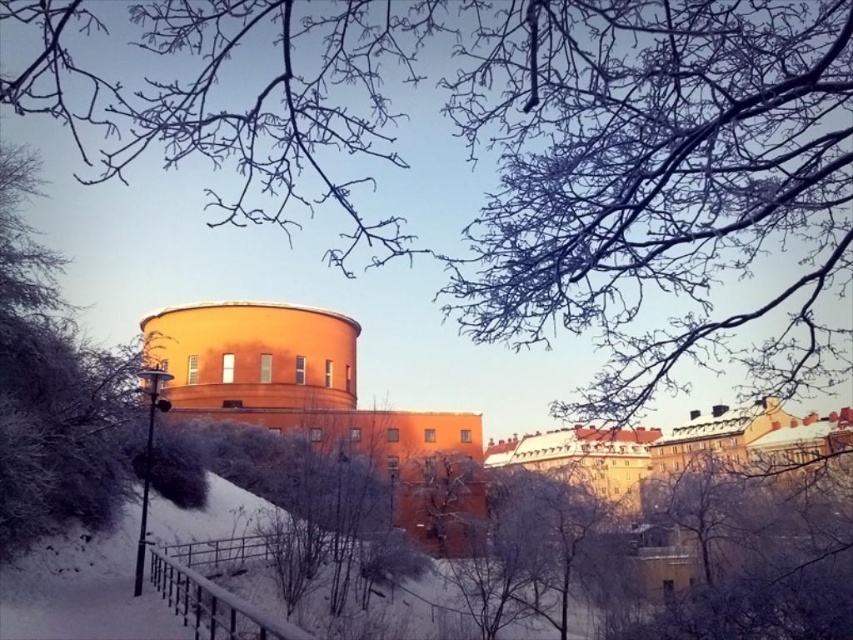
Question: Is frosty branches at upper center bigger than snow-covered branches at left?

Choices:
 (A) yes
 (B) no

Answer: (A)

Question: Which point is farther to the camera?

Choices:
 (A) frosty branches at upper center
 (B) snow-covered branches at left

Answer: (B)

Question: Which point appears farthest from the camera in this image?

Choices:
 (A) (16, 372)
 (B) (105, 170)

Answer: (A)

Question: Where is snow-covered branches at left located in relation to frosty bark tree at center in the image?

Choices:
 (A) above
 (B) below

Answer: (A)

Question: Among these points, which one is nearest to the camera?

Choices:
 (A) (9, 387)
 (B) (445, 529)

Answer: (A)

Question: Is frosty branches at upper center to the left of snow-covered branches at left from the viewer's perspective?

Choices:
 (A) no
 (B) yes

Answer: (A)